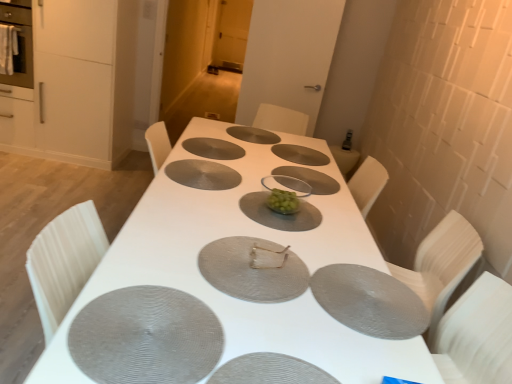
Question: Considering the relative sizes of matte gray pizza pan at center, which ranks as the eighth pizza pan in back-to-front order, and silver textured pizza pan at center, the eighth pizza pan when ordered from front to back, in the image provided, is matte gray pizza pan at center, which ranks as the eighth pizza pan in back-to-front order, wider than silver textured pizza pan at center, the eighth pizza pan when ordered from front to back,?

Choices:
 (A) no
 (B) yes

Answer: (B)

Question: Is matte gray pizza pan at center, which ranks as the eighth pizza pan in back-to-front order, positioned behind silver textured pizza pan at center, the eighth pizza pan when ordered from front to back?

Choices:
 (A) no
 (B) yes

Answer: (A)

Question: Is matte gray pizza pan at center, which appears as the 1th pizza pan when viewed from the front, not near silver textured pizza pan at center, the eighth pizza pan when ordered from front to back?

Choices:
 (A) no
 (B) yes

Answer: (B)

Question: Is matte gray pizza pan at center, which ranks as the eighth pizza pan in back-to-front order, next to silver textured pizza pan at center, the eighth pizza pan when ordered from front to back?

Choices:
 (A) yes
 (B) no

Answer: (B)

Question: Is silver textured pizza pan at center, the eighth pizza pan when ordered from front to back, inside matte gray pizza pan at center, which ranks as the eighth pizza pan in back-to-front order?

Choices:
 (A) no
 (B) yes

Answer: (A)

Question: From the image's perspective, is matte gray pizza pan at center, which appears as the 1th pizza pan when viewed from the front, above silver textured pizza pan at center, the eighth pizza pan when ordered from front to back?

Choices:
 (A) yes
 (B) no

Answer: (B)

Question: Considering the relative sizes of matte stainless steel oven at left and gray textured placemat at center, marked as the 2th pizza pan in a front-to-back arrangement, in the image provided, is matte stainless steel oven at left shorter than gray textured placemat at center, marked as the 2th pizza pan in a front-to-back arrangement,?

Choices:
 (A) no
 (B) yes

Answer: (A)

Question: Does matte stainless steel oven at left turn towards gray textured placemat at center, marked as the 2th pizza pan in a front-to-back arrangement?

Choices:
 (A) yes
 (B) no

Answer: (B)

Question: From a real-world perspective, is matte stainless steel oven at left located beneath gray textured placemat at center, marked as the 2th pizza pan in a front-to-back arrangement?

Choices:
 (A) no
 (B) yes

Answer: (A)

Question: Is matte stainless steel oven at left taller than gray textured placemat at center, marked as the 2th pizza pan in a front-to-back arrangement?

Choices:
 (A) no
 (B) yes

Answer: (B)

Question: Is matte stainless steel oven at left positioned in front of gray textured placemat at center, placed as the 7th pizza pan when sorted from back to front?

Choices:
 (A) yes
 (B) no

Answer: (B)

Question: Is gray textured placemat at center, placed as the 7th pizza pan when sorted from back to front, at the back of matte stainless steel oven at left?

Choices:
 (A) no
 (B) yes

Answer: (A)

Question: Does clear plastic plate at center come behind metallic silver napkin at center?

Choices:
 (A) yes
 (B) no

Answer: (A)